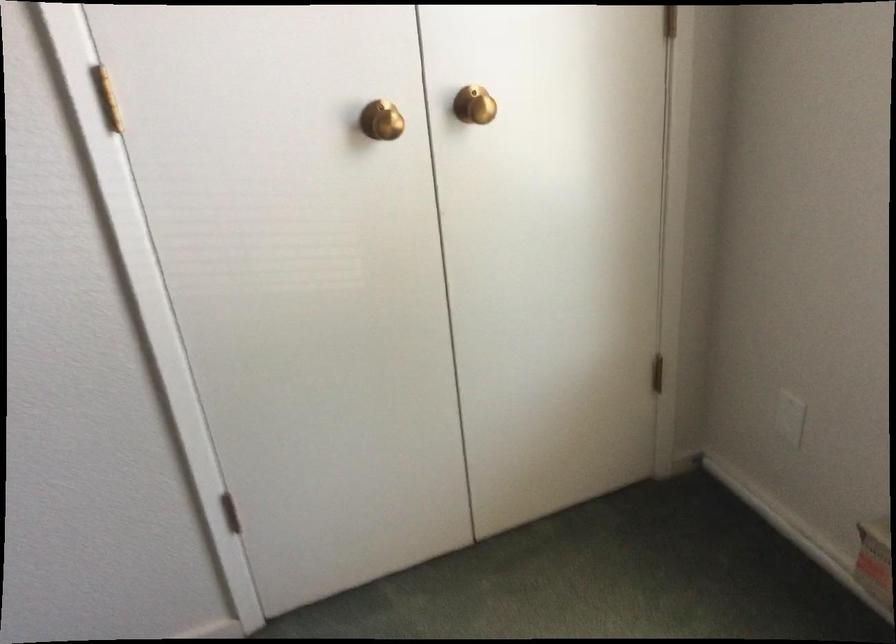
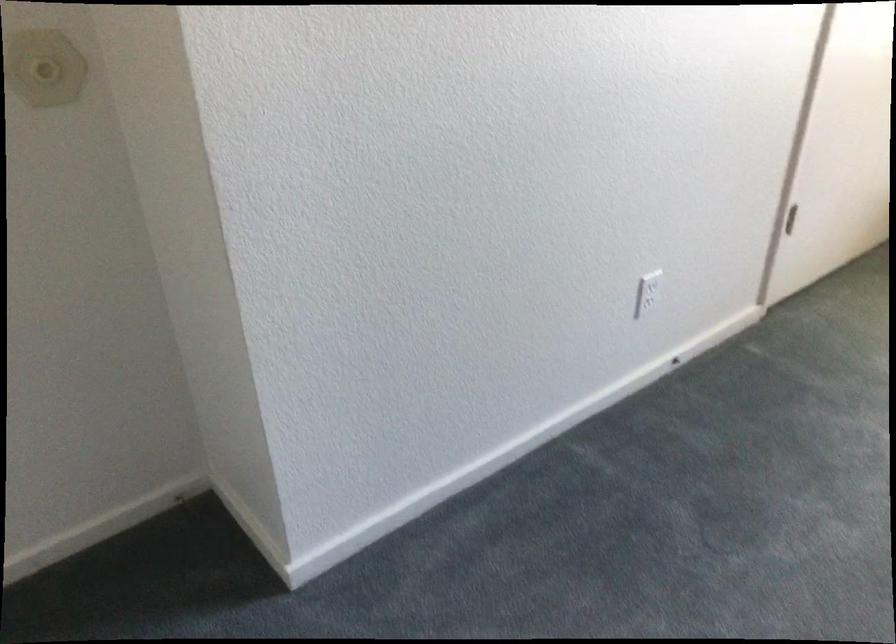
Find the pixel in the second image that matches pixel 259 504 in the first image.

(790, 219)